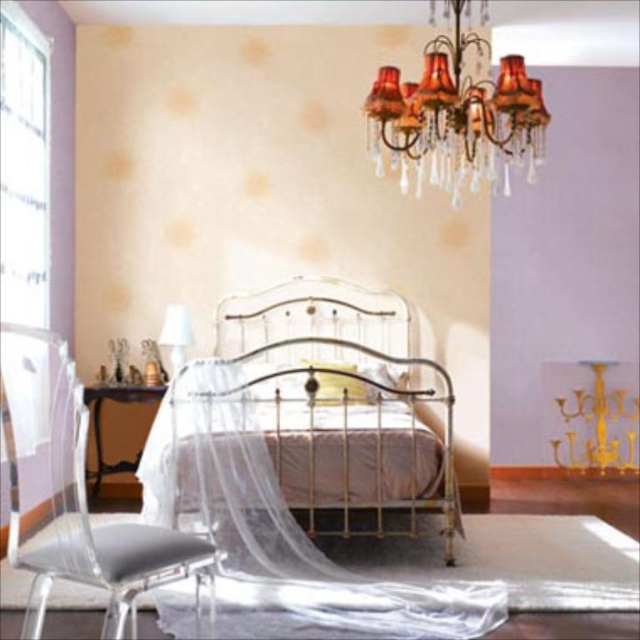
Between gold metallic bed at center and white fabric lampshade at center, which one appears on the left side from the viewer's perspective?

white fabric lampshade at center is more to the left.

Does gold metallic bed at center have a larger size compared to white fabric lampshade at center?

Correct, gold metallic bed at center is larger in size than white fabric lampshade at center.

Who is more distant from viewer, (356, 474) or (177, 369)?

Positioned behind is point (177, 369).

You are a GUI agent. You are given a task and a screenshot of the screen. Output one action in this format:
    pyautogui.click(x=<x>, y=<y>)
    Task: Click on the gold metallic bed at center
    The height and width of the screenshot is (640, 640).
    Given the screenshot: What is the action you would take?
    [342, 404]

Consider the image. Is gold metallic bed at center above orange fabric chandelier at upper center?

Actually, gold metallic bed at center is below orange fabric chandelier at upper center.

Which is more to the left, gold metallic bed at center or orange fabric chandelier at upper center?

Positioned to the left is gold metallic bed at center.

Image resolution: width=640 pixels, height=640 pixels. What do you see at coordinates (342, 404) in the screenshot?
I see `gold metallic bed at center` at bounding box center [342, 404].

Locate an element on the screen. The image size is (640, 640). gold metallic bed at center is located at coordinates (342, 404).

Between orange fabric chandelier at upper center and white fabric lampshade at center, which one has less height?

Standing shorter between the two is white fabric lampshade at center.

The image size is (640, 640). I want to click on orange fabric chandelier at upper center, so click(x=456, y=115).